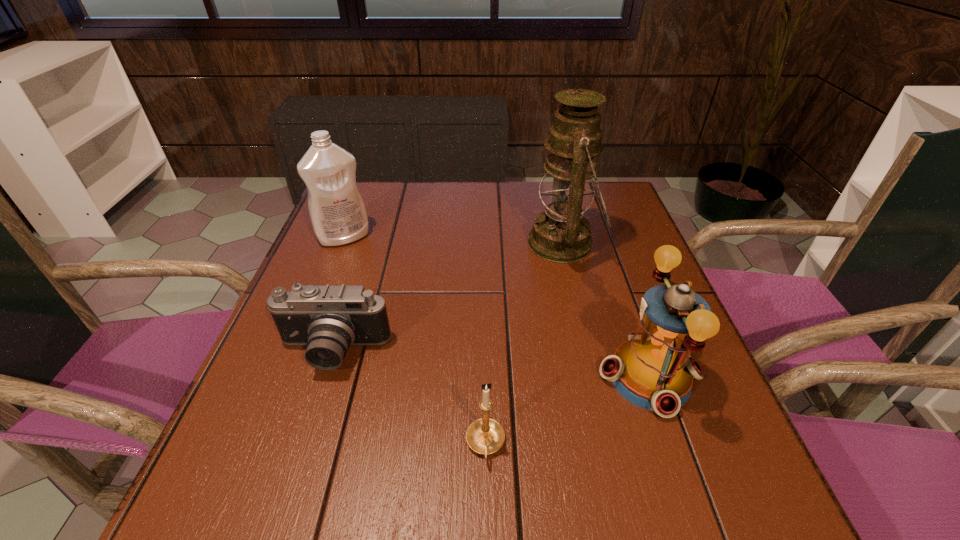
I want to click on vacant area that lies between the detergent and the third object from left to right, so [415, 341].

Locate an element on the screen. The image size is (960, 540). free spot between the tallest object and the lantern is located at coordinates (607, 310).

The image size is (960, 540). In order to click on vacant point located between the tallest object and the third tallest object in this screenshot , I will do `click(607, 310)`.

Identify the location of free space that is in between the camera and the candle holder. The image size is (960, 540). (409, 399).

I want to click on empty space between the oil lamp and the detergent, so click(454, 240).

The height and width of the screenshot is (540, 960). Identify the location of object that is the third closest to the candle holder. (562, 234).

Locate an element on the screen. the third closest object relative to the detergent is located at coordinates (485, 436).